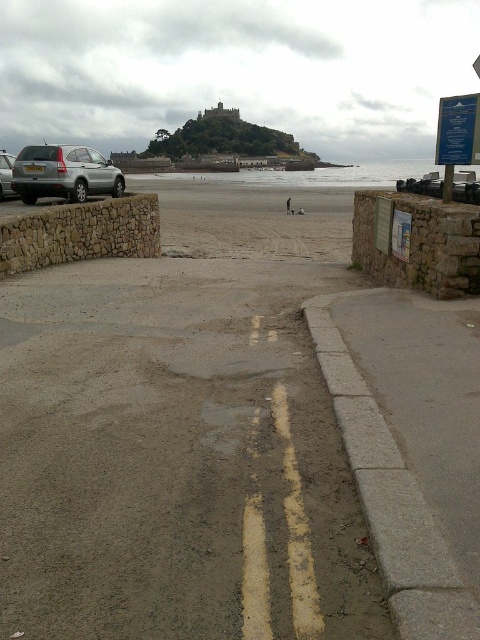
You are a tourist trying to find parking near the castle. You see the blue plastic sign at upper right and the silver metallic car at left. Which object is smaller in size?

The blue plastic sign at upper right has a smaller size compared to the silver metallic car at left, so the blue plastic sign at upper right is the smaller object.

Looking at this image, you are a delivery person trying to reach the gray concrete curb at lower right with a cart that can only move on paved surfaces. The smooth sand beach at center is in your way. Can you go around it without crossing the sand?

The gray concrete curb at lower right is behind the smooth sand beach at center, so you would need to go around the smooth sand beach at center to reach the curb. Since the cart can only move on paved surfaces, you should follow the paved area marked by the double yellow lines to the right of the beach to reach the curb without crossing the sand.